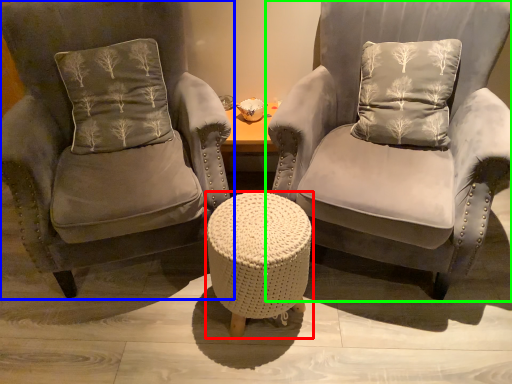
Question: Based on their relative distances, which object is nearer to table (highlighted by a red box)? Choose from chair (highlighted by a blue box) and chair (highlighted by a green box).

Choices:
 (A) chair
 (B) chair

Answer: (B)